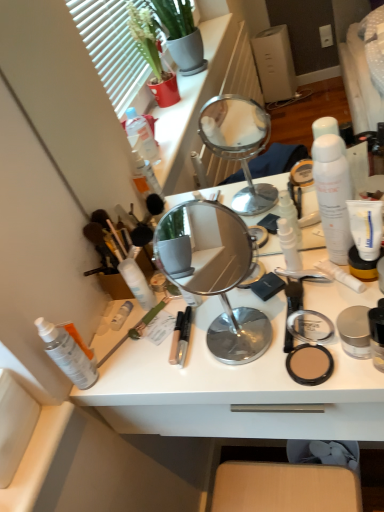
Locate an element on the screen. The width and height of the screenshot is (384, 512). vacant space in between white matte spray can at center, which is the third toiletry in right-to-left order, and white matte tube at right, acting as the first toothpaste starting from the top is located at coordinates (241, 293).